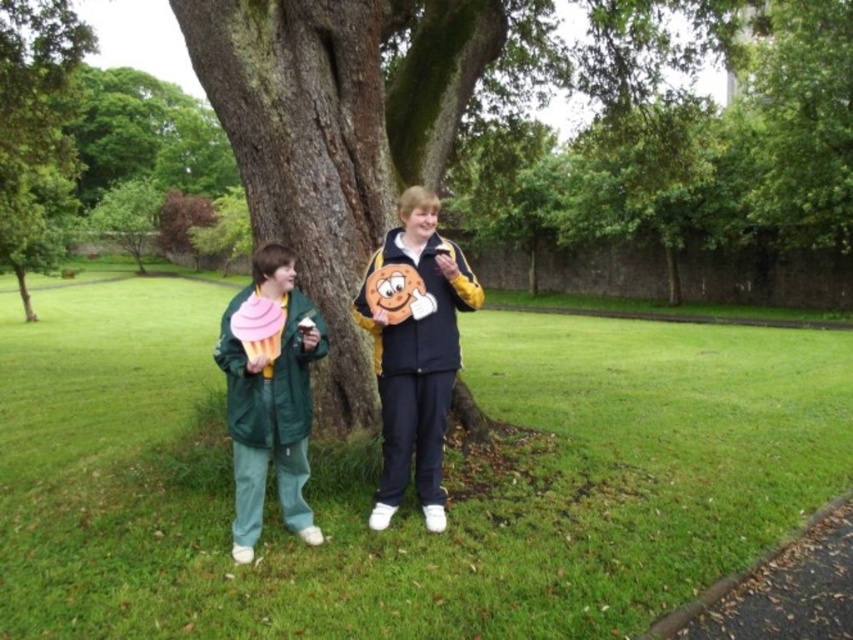
Based on the photo, can you confirm if green grass at center is thinner than matte yellow jacket at center?

In fact, green grass at center might be wider than matte yellow jacket at center.

Between green grass at center and matte yellow jacket at center, which one appears on the right side from the viewer's perspective?

Positioned to the right is matte yellow jacket at center.

Between point (73, 442) and point (399, 371), which one is positioned in front?

Point (399, 371) is in front.

Locate an element on the screen. The height and width of the screenshot is (640, 853). green grass at center is located at coordinates (410, 486).

Based on the photo, can you confirm if green grass at center is positioned to the left of green matte jacket at left?

Indeed, green grass at center is positioned on the left side of green matte jacket at left.

Is green grass at center below green matte jacket at left?

Yes, green grass at center is below green matte jacket at left.

Is point (567, 600) closer to camera compared to point (323, 353)?

Yes.

You are a GUI agent. You are given a task and a screenshot of the screen. Output one action in this format:
    pyautogui.click(x=<x>, y=<y>)
    Task: Click on the green grass at center
    This screenshot has height=640, width=853.
    Given the screenshot: What is the action you would take?
    pyautogui.click(x=410, y=486)

Can you confirm if green matte jacket at left is bigger than green leafy tree at center?

No.

Does point (276, 276) come in front of point (64, 160)?

Yes, it is in front of point (64, 160).

Where is `green matte jacket at left`? green matte jacket at left is located at coordinates (270, 394).